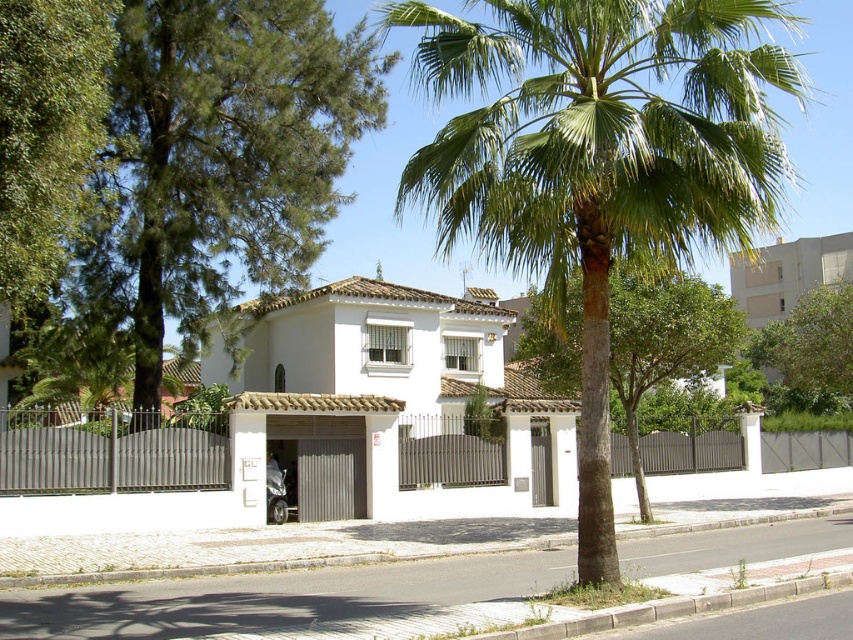
Can you confirm if green leafy palm tree at center is positioned above green leafy tree at center?

Yes, green leafy palm tree at center is above green leafy tree at center.

What do you see at coordinates (601, 160) in the screenshot?
I see `green leafy palm tree at center` at bounding box center [601, 160].

Describe the element at coordinates (601, 160) in the screenshot. I see `green leafy palm tree at center` at that location.

I want to click on green leafy palm tree at center, so click(601, 160).